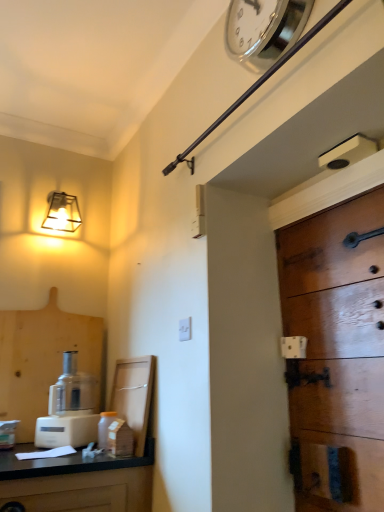
Question: Does white plastic food processor at lower left touch white plastic light switch at center?

Choices:
 (A) yes
 (B) no

Answer: (B)

Question: Is white plastic food processor at lower left thinner than white plastic light switch at center?

Choices:
 (A) yes
 (B) no

Answer: (B)

Question: Can you confirm if white plastic food processor at lower left is bigger than white plastic light switch at center?

Choices:
 (A) yes
 (B) no

Answer: (A)

Question: Is white plastic food processor at lower left taller than white plastic light switch at center?

Choices:
 (A) no
 (B) yes

Answer: (B)

Question: Is white plastic light switch at center completely or partially inside white plastic food processor at lower left?

Choices:
 (A) yes
 (B) no

Answer: (B)

Question: From the image's perspective, is white plastic food processor at lower left on white plastic light switch at center?

Choices:
 (A) no
 (B) yes

Answer: (A)

Question: Is white plastic light switch at center aimed at white plastic food processor at lower left?

Choices:
 (A) yes
 (B) no

Answer: (B)

Question: Does white plastic light switch at center have a smaller size compared to white plastic food processor at lower left?

Choices:
 (A) yes
 (B) no

Answer: (A)

Question: From the image's perspective, is white plastic light switch at center over white plastic food processor at lower left?

Choices:
 (A) yes
 (B) no

Answer: (A)

Question: Is white plastic light switch at center directly adjacent to white plastic food processor at lower left?

Choices:
 (A) no
 (B) yes

Answer: (A)

Question: Is white plastic food processor at lower left at the back of white plastic light switch at center?

Choices:
 (A) yes
 (B) no

Answer: (B)

Question: Can you confirm if white plastic light switch at center is shorter than white plastic food processor at lower left?

Choices:
 (A) no
 (B) yes

Answer: (B)

Question: Does metallic square lamp at upper left have a greater height compared to silver metallic clock at upper center?

Choices:
 (A) yes
 (B) no

Answer: (B)